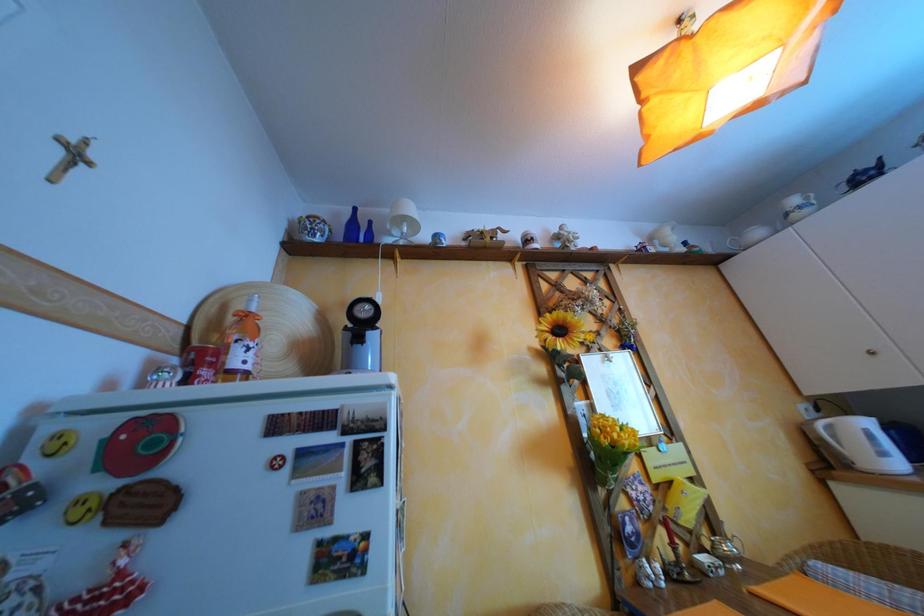
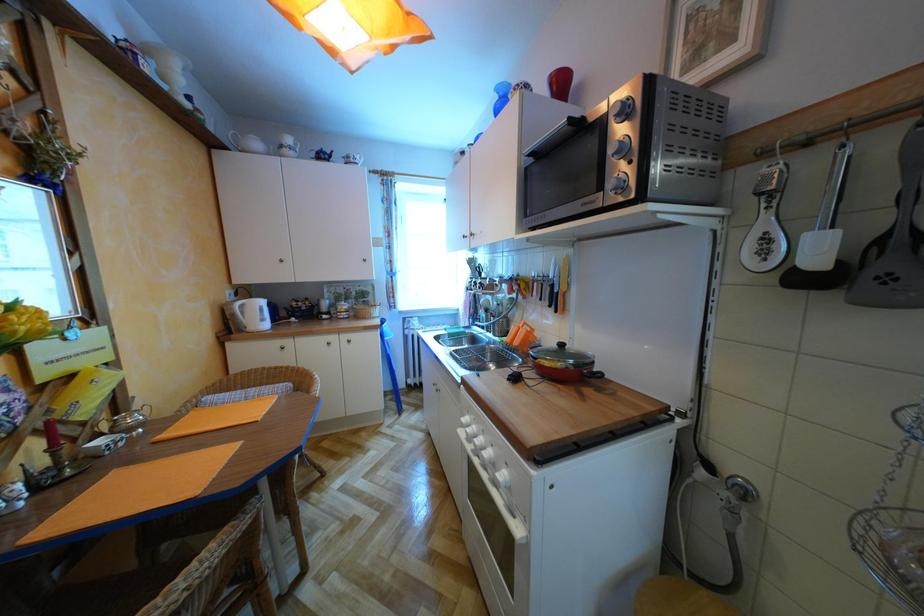
Question: The camera is either moving clockwise (left) or counter-clockwise (right) around the object. The first image is from the beginning of the video and the second image is from the end. Is the camera moving left or right when shooting the video?

Choices:
 (A) Left
 (B) Right

Answer: (A)